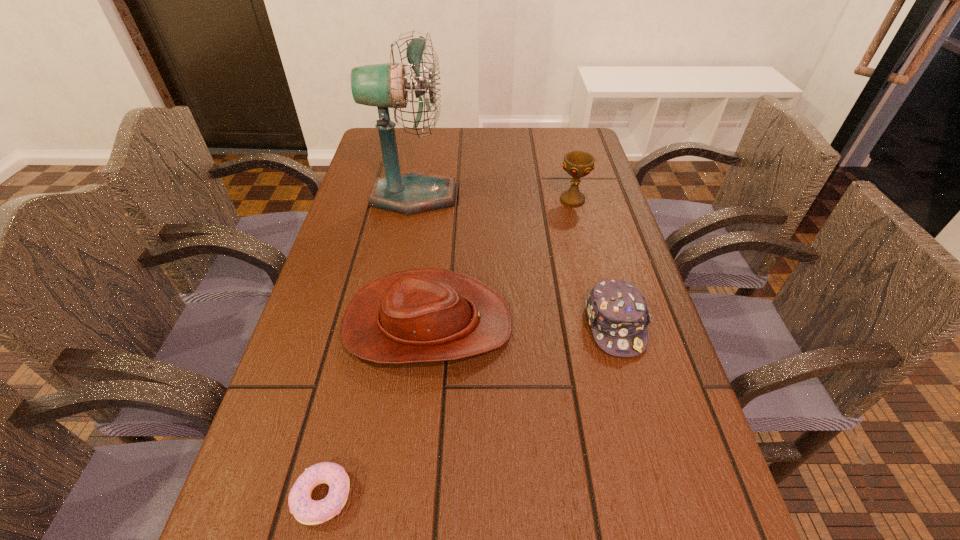
Where is `the third closest object to the fourth shortest object`? Image resolution: width=960 pixels, height=540 pixels. the third closest object to the fourth shortest object is located at coordinates (617, 311).

Where is `free space that satisfies the following two spatial constraints: 1. in front of the tallest object where the wind blows; 2. on the back side of the fourth shortest object`? free space that satisfies the following two spatial constraints: 1. in front of the tallest object where the wind blows; 2. on the back side of the fourth shortest object is located at coordinates (413, 199).

Locate an element on the screen. free spot that satisfies the following two spatial constraints: 1. on the back side of the chalice; 2. in front of the tallest object where the wind blows is located at coordinates (571, 196).

Image resolution: width=960 pixels, height=540 pixels. I want to click on vacant space that satisfies the following two spatial constraints: 1. in front of the fourth shortest object where the wind blows; 2. on the left side of the fan, so click(x=413, y=199).